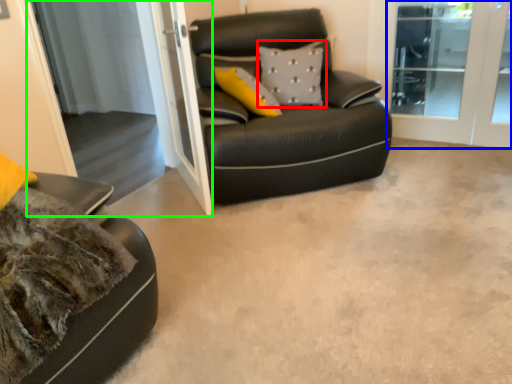
Question: Estimate the real-world distances between objects in this image. Which object is closer to pillow (highlighted by a red box), screen door (highlighted by a blue box) or screen door (highlighted by a green box)?

Choices:
 (A) screen door
 (B) screen door

Answer: (B)